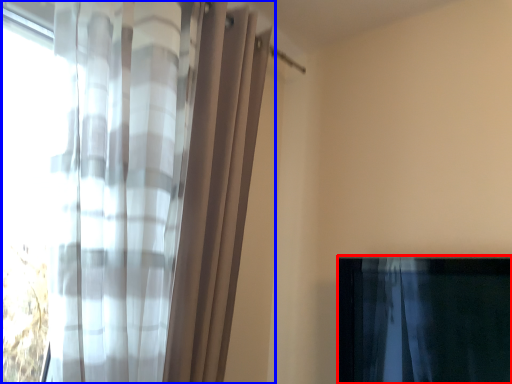
Question: Which object appears closest to the camera in this image, curtain (highlighted by a red box) or curtain (highlighted by a blue box)?

Choices:
 (A) curtain
 (B) curtain

Answer: (B)